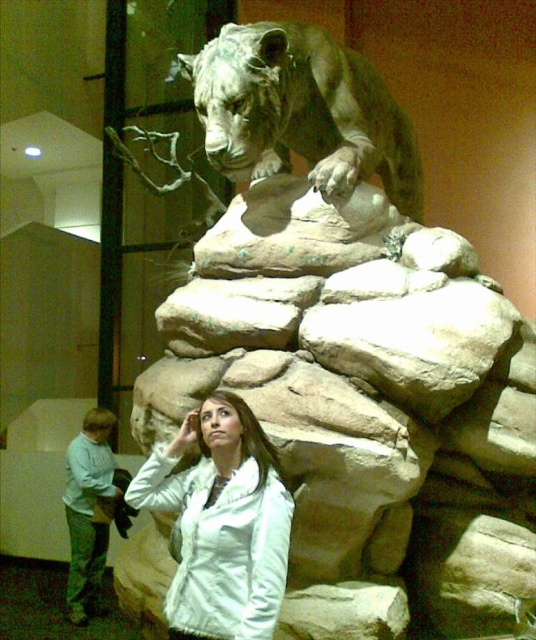
You are standing in the museum and want to take a photo of the bronze statue of a lion at upper center without the white matte jacket at center blocking the view. Is the jacket currently in the way?

The bronze statue of a lion at upper center is located above the white matte jacket at center, so the jacket is below the statue and not blocking the view. You can take the photo without any obstruction.

You are an art curator assessing the spatial arrangement in the museum. You need to determine if the bronze statue of a lion at upper center can be moved closer to the white matte jacket at center without overlapping. Based on their widths, can this be done?

The bronze statue of a lion at upper center is wider than the white matte jacket at center. Since the statue is wider, moving it closer might cause overlap unless there is sufficient space. However, the exact distance isn